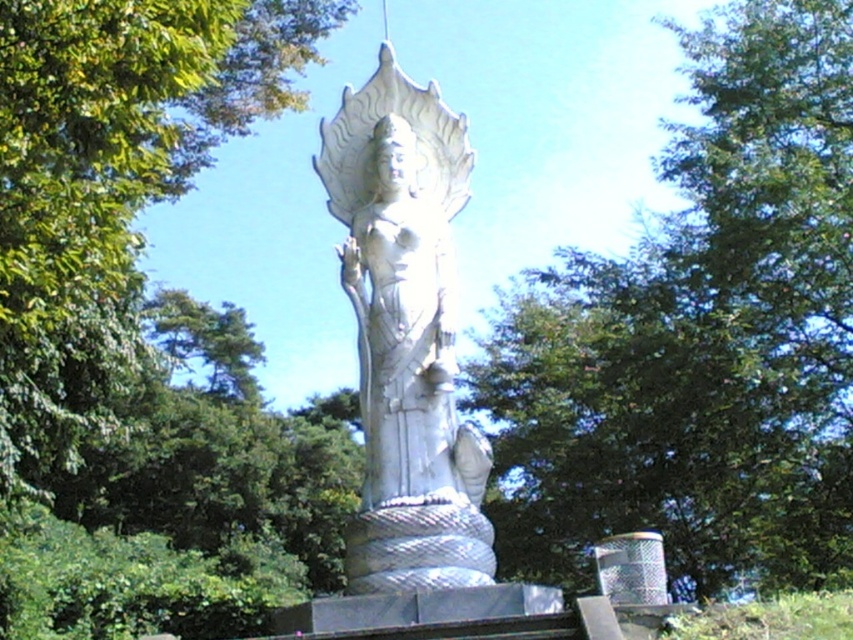
Who is shorter, green leafy tree at center or green leafy tree at upper left?

Standing shorter between the two is green leafy tree at upper left.

Which is below, green leafy tree at center or green leafy tree at upper left?

Positioned lower is green leafy tree at upper left.

Is point (704, 172) positioned in front of point (49, 120)?

No, (704, 172) is further to viewer.

The height and width of the screenshot is (640, 853). Find the location of `green leafy tree at center`. green leafy tree at center is located at coordinates (699, 339).

Is green leafy tree at upper left bigger than white stone statue at center?

Yes, green leafy tree at upper left is bigger than white stone statue at center.

Is the position of green leafy tree at upper left more distant than that of white stone statue at center?

No.

At what (x,y) coordinates should I click in order to perform the action: click on green leafy tree at upper left. Please return your answer as a coordinate pair (x, y). Image resolution: width=853 pixels, height=640 pixels. Looking at the image, I should click on (109, 180).

This screenshot has width=853, height=640. In order to click on green leafy tree at upper left in this screenshot , I will do `click(109, 180)`.

Who is shorter, green leafy tree at center or white stone statue at center?

With less height is white stone statue at center.

Measure the distance between point (724, 392) and camera.

Point (724, 392) and camera are 89.43 meters apart.

Is point (498, 465) positioned before point (469, 468)?

No.

The height and width of the screenshot is (640, 853). I want to click on green leafy tree at center, so click(x=699, y=339).